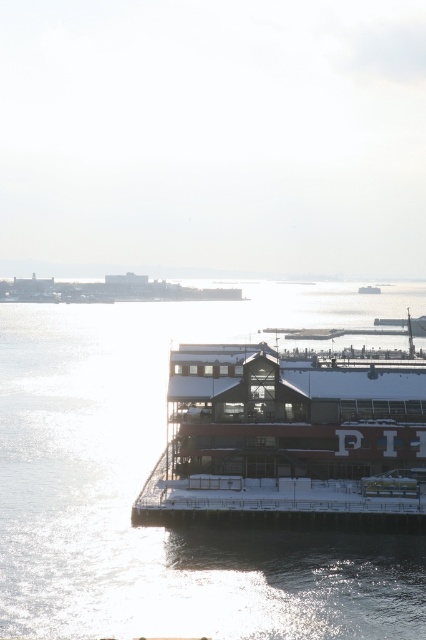
Which of these two, glistening water at lower center or snow-covered wooden pier at center, stands taller?

glistening water at lower center is taller.

Between point (80, 508) and point (339, 465), which one is positioned in front?

Point (80, 508) is more forward.

The image size is (426, 640). In order to click on glistening water at lower center in this screenshot , I will do `click(147, 474)`.